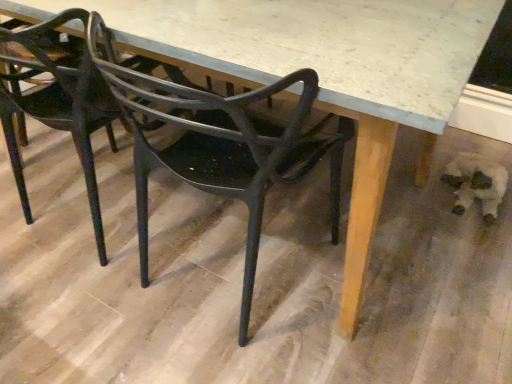
This screenshot has height=384, width=512. What do you see at coordinates (57, 100) in the screenshot?
I see `matte black chair at center, placed as the second chair when sorted from right to left` at bounding box center [57, 100].

The height and width of the screenshot is (384, 512). I want to click on matte black chair at center, placed as the second chair when sorted from right to left, so click(x=57, y=100).

Describe the element at coordinates (221, 146) in the screenshot. The height and width of the screenshot is (384, 512). I see `matte black chair at center, marked as the first chair in a right-to-left arrangement` at that location.

I want to click on matte black chair at center, the 1th chair in the left-to-right sequence, so click(57, 100).

Does matte black chair at center, placed as the second chair when sorted from right to left, lie in front of fuzzy white dog at lower right?

Yes, the depth of matte black chair at center, placed as the second chair when sorted from right to left, is less than that of fuzzy white dog at lower right.

Considering the sizes of objects matte black chair at center, the 1th chair in the left-to-right sequence, and fuzzy white dog at lower right in the image provided, who is taller, matte black chair at center, the 1th chair in the left-to-right sequence, or fuzzy white dog at lower right?

Standing taller between the two is matte black chair at center, the 1th chair in the left-to-right sequence.

From the image's perspective, is matte black chair at center, the 1th chair in the left-to-right sequence, located above fuzzy white dog at lower right?

Yes, from the image's perspective, matte black chair at center, the 1th chair in the left-to-right sequence, is on top of fuzzy white dog at lower right.

Are matte black chair at center, placed as the second chair when sorted from right to left, and fuzzy white dog at lower right far apart?

That's right, there is a large distance between matte black chair at center, placed as the second chair when sorted from right to left, and fuzzy white dog at lower right.

Which object is closer to the camera, fuzzy white dog at lower right or matte black chair at center, marked as the first chair in a right-to-left arrangement?

matte black chair at center, marked as the first chair in a right-to-left arrangement.

Is fuzzy white dog at lower right not near matte black chair at center, marked as the first chair in a right-to-left arrangement?

No, fuzzy white dog at lower right is in close proximity to matte black chair at center, marked as the first chair in a right-to-left arrangement.

From a real-world perspective, which object rests below the other?

fuzzy white dog at lower right is physically lower.

Is matte black chair at center, marked as the first chair in a right-to-left arrangement, completely or partially inside fuzzy white dog at lower right?

No, matte black chair at center, marked as the first chair in a right-to-left arrangement, is not a part of fuzzy white dog at lower right.

Considering the relative sizes of matte black chair at center, the second chair positioned from the left, and fuzzy white dog at lower right in the image provided, is matte black chair at center, the second chair positioned from the left, thinner than fuzzy white dog at lower right?

No.

Is matte black chair at center, the second chair positioned from the left, positioned far away from fuzzy white dog at lower right?

No, there isn't a large distance between matte black chair at center, the second chair positioned from the left, and fuzzy white dog at lower right.

Is matte black chair at center, marked as the first chair in a right-to-left arrangement, spatially inside fuzzy white dog at lower right, or outside of it?

matte black chair at center, marked as the first chair in a right-to-left arrangement, is located beyond the bounds of fuzzy white dog at lower right.

Is fuzzy white dog at lower right to the right of matte black chair at center, the 1th chair in the left-to-right sequence, from the viewer's perspective?

Yes.

Is fuzzy white dog at lower right taller than matte black chair at center, placed as the second chair when sorted from right to left?

No, fuzzy white dog at lower right is not taller than matte black chair at center, placed as the second chair when sorted from right to left.

From the image's perspective, is fuzzy white dog at lower right beneath matte black chair at center, the 1th chair in the left-to-right sequence?

Indeed, from the image's perspective, fuzzy white dog at lower right is shown beneath matte black chair at center, the 1th chair in the left-to-right sequence.

How different are the orientations of fuzzy white dog at lower right and matte black chair at center, placed as the second chair when sorted from right to left, in degrees?

They differ by 179 degrees in their facing directions.

Which object is wider, matte black chair at center, marked as the first chair in a right-to-left arrangement, or matte black chair at center, the 1th chair in the left-to-right sequence?

matte black chair at center, the 1th chair in the left-to-right sequence, is wider.

Relative to matte black chair at center, placed as the second chair when sorted from right to left, is matte black chair at center, marked as the first chair in a right-to-left arrangement, in front or behind?

matte black chair at center, marked as the first chair in a right-to-left arrangement, is in front of matte black chair at center, placed as the second chair when sorted from right to left.

From the image's perspective, is matte black chair at center, marked as the first chair in a right-to-left arrangement, located above matte black chair at center, placed as the second chair when sorted from right to left?

Incorrect, from the image's perspective, matte black chair at center, marked as the first chair in a right-to-left arrangement, is lower than matte black chair at center, placed as the second chair when sorted from right to left.

From a real-world perspective, between matte black chair at center, placed as the second chair when sorted from right to left, and matte black chair at center, the second chair positioned from the left, who is vertically higher?

matte black chair at center, placed as the second chair when sorted from right to left.

Does matte black chair at center, placed as the second chair when sorted from right to left, contain matte black chair at center, the second chair positioned from the left?

No, matte black chair at center, the second chair positioned from the left, is located outside of matte black chair at center, placed as the second chair when sorted from right to left.

What's the angular difference between matte black chair at center, the 1th chair in the left-to-right sequence, and matte black chair at center, the second chair positioned from the left,'s facing directions?

0.000892 degrees.

Which object is thinner, matte black chair at center, placed as the second chair when sorted from right to left, or matte black chair at center, marked as the first chair in a right-to-left arrangement?

Thinner between the two is matte black chair at center, marked as the first chair in a right-to-left arrangement.

Locate an element on the screen. The height and width of the screenshot is (384, 512). animal below the matte black chair at center, the 1th chair in the left-to-right sequence (from the image's perspective) is located at coordinates (476, 183).

In order to click on the 1st chair to the left when counting from the fuzzy white dog at lower right in this screenshot , I will do `click(221, 146)`.

Which object lies nearer to the anchor point matte black chair at center, the 1th chair in the left-to-right sequence, matte black chair at center, the second chair positioned from the left, or fuzzy white dog at lower right?

Based on the image, matte black chair at center, the second chair positioned from the left, appears to be nearer to matte black chair at center, the 1th chair in the left-to-right sequence.

Based on their spatial positions, is fuzzy white dog at lower right or matte black chair at center, marked as the first chair in a right-to-left arrangement, further from matte black chair at center, placed as the second chair when sorted from right to left?

Among the two, fuzzy white dog at lower right is located further to matte black chair at center, placed as the second chair when sorted from right to left.

In the scene shown: Considering their positions, is fuzzy white dog at lower right positioned closer to matte black chair at center, the second chair positioned from the left, than matte black chair at center, the 1th chair in the left-to-right sequence?

Based on the image, matte black chair at center, the 1th chair in the left-to-right sequence, appears to be nearer to matte black chair at center, the second chair positioned from the left.

Based on their spatial positions, is matte black chair at center, marked as the first chair in a right-to-left arrangement, or matte black chair at center, the 1th chair in the left-to-right sequence, closer to fuzzy white dog at lower right?

matte black chair at center, marked as the first chair in a right-to-left arrangement.

Considering their positions, is matte black chair at center, the 1th chair in the left-to-right sequence, positioned closer to fuzzy white dog at lower right than matte black chair at center, the second chair positioned from the left?

matte black chair at center, the second chair positioned from the left, is closer to fuzzy white dog at lower right.

Looking at the image, which one is located closer to matte black chair at center, the second chair positioned from the left, matte black chair at center, placed as the second chair when sorted from right to left, or fuzzy white dog at lower right?

matte black chair at center, placed as the second chair when sorted from right to left, lies closer to matte black chair at center, the second chair positioned from the left, than the other object.

I want to click on chair between matte black chair at center, the 1th chair in the left-to-right sequence, and fuzzy white dog at lower right, in the horizontal direction, so click(221, 146).